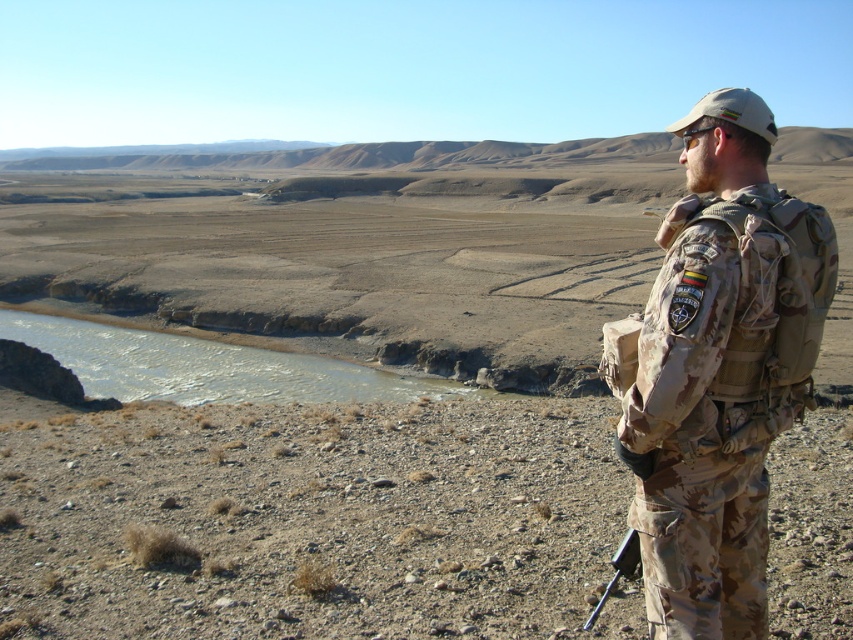
Question: Which object appears closest to the camera in this image?

Choices:
 (A) camouflage uniform at right
 (B) black plastic rifle at lower right

Answer: (A)

Question: Observing the image, what is the correct spatial positioning of camouflage uniform at right in reference to black plastic rifle at lower right?

Choices:
 (A) above
 (B) below

Answer: (A)

Question: Which object is closer to the camera taking this photo?

Choices:
 (A) camouflage uniform at right
 (B) black plastic rifle at lower right

Answer: (A)

Question: Is camouflage uniform at right further to camera compared to black plastic rifle at lower right?

Choices:
 (A) no
 (B) yes

Answer: (A)

Question: Which point is farther to the camera?

Choices:
 (A) (618, 548)
 (B) (796, 381)

Answer: (A)

Question: Can you confirm if camouflage uniform at right is bigger than black plastic rifle at lower right?

Choices:
 (A) yes
 (B) no

Answer: (A)